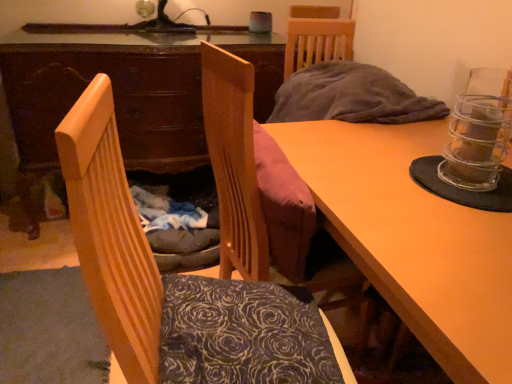
Question: Does wooden desk at center appear on the left side of velvet pink cushion at center, placed as the 1th chair when sorted from back to front?

Choices:
 (A) no
 (B) yes

Answer: (B)

Question: Considering the relative sizes of wooden desk at center and velvet pink cushion at center, the second chair from the front, in the image provided, is wooden desk at center shorter than velvet pink cushion at center, the second chair from the front,?

Choices:
 (A) yes
 (B) no

Answer: (B)

Question: Is wooden desk at center oriented away from velvet pink cushion at center, placed as the 1th chair when sorted from back to front?

Choices:
 (A) yes
 (B) no

Answer: (B)

Question: Is wooden desk at center taller than velvet pink cushion at center, placed as the 1th chair when sorted from back to front?

Choices:
 (A) yes
 (B) no

Answer: (A)

Question: Considering the relative sizes of wooden desk at center and velvet pink cushion at center, the second chair from the front, in the image provided, is wooden desk at center wider than velvet pink cushion at center, the second chair from the front,?

Choices:
 (A) yes
 (B) no

Answer: (A)

Question: From the image's perspective, does wooden desk at center appear higher than velvet pink cushion at center, placed as the 1th chair when sorted from back to front?

Choices:
 (A) no
 (B) yes

Answer: (B)

Question: Can you confirm if velvet pink cushion at center, placed as the 1th chair when sorted from back to front, is smaller than wooden table at center?

Choices:
 (A) no
 (B) yes

Answer: (B)

Question: Is wooden table at center surrounded by velvet pink cushion at center, placed as the 1th chair when sorted from back to front?

Choices:
 (A) yes
 (B) no

Answer: (B)

Question: Is velvet pink cushion at center, placed as the 1th chair when sorted from back to front, further to camera compared to wooden table at center?

Choices:
 (A) yes
 (B) no

Answer: (A)

Question: From a real-world perspective, is velvet pink cushion at center, placed as the 1th chair when sorted from back to front, physically below wooden table at center?

Choices:
 (A) no
 (B) yes

Answer: (A)

Question: Can you confirm if velvet pink cushion at center, the second chair from the front, is bigger than wooden table at center?

Choices:
 (A) no
 (B) yes

Answer: (A)

Question: Does velvet pink cushion at center, placed as the 1th chair when sorted from back to front, have a greater width compared to wooden table at center?

Choices:
 (A) yes
 (B) no

Answer: (B)

Question: From a real-world perspective, is wooden chair at left, which ranks as the second chair in back-to-front order, positioned under dark floral fabric pillow at center based on gravity?

Choices:
 (A) yes
 (B) no

Answer: (B)